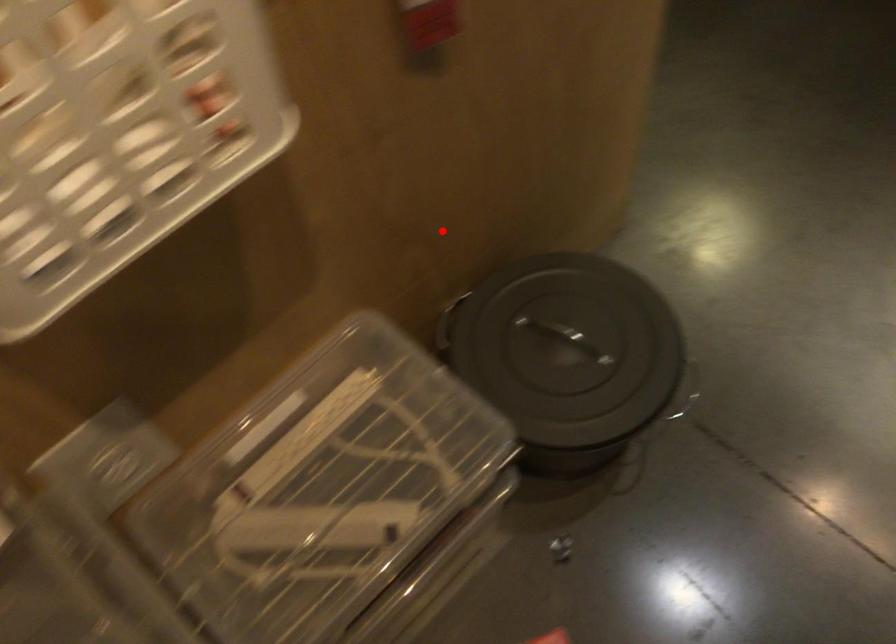
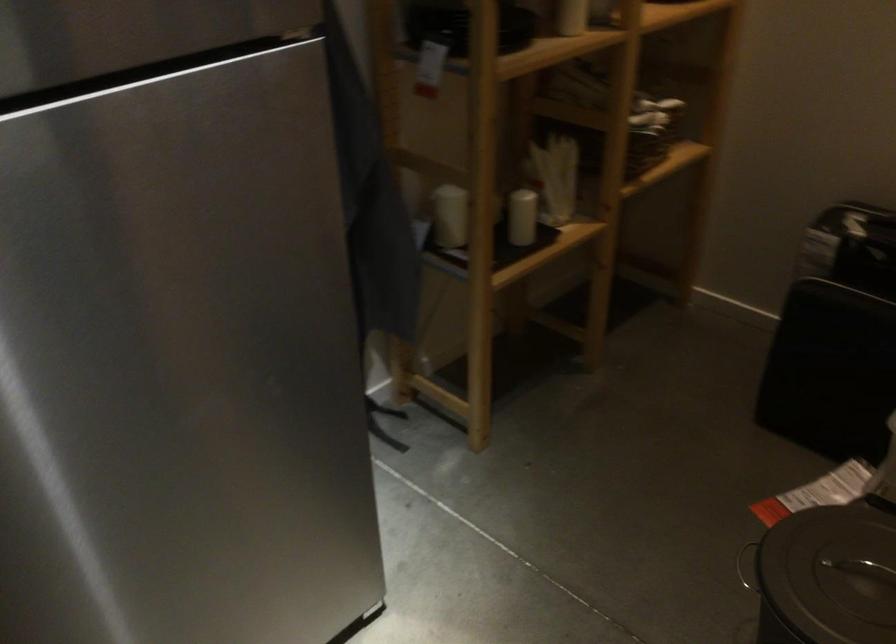
Question: A red point is marked in image1. In image2, is the corresponding 3D point closer to the camera or farther? Reply with the corresponding letter.

Choices:
 (A) The corresponding 3D point is closer.
 (B) The corresponding 3D point is farther.

Answer: (B)